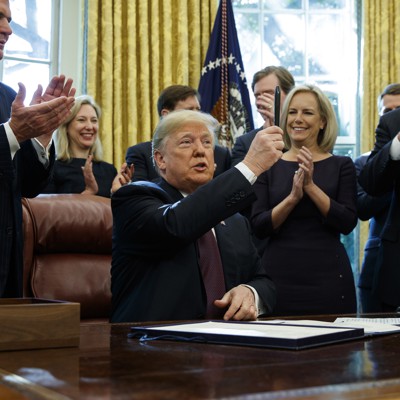
Locate an element on the screen. windows is located at coordinates (328, 50), (33, 82).